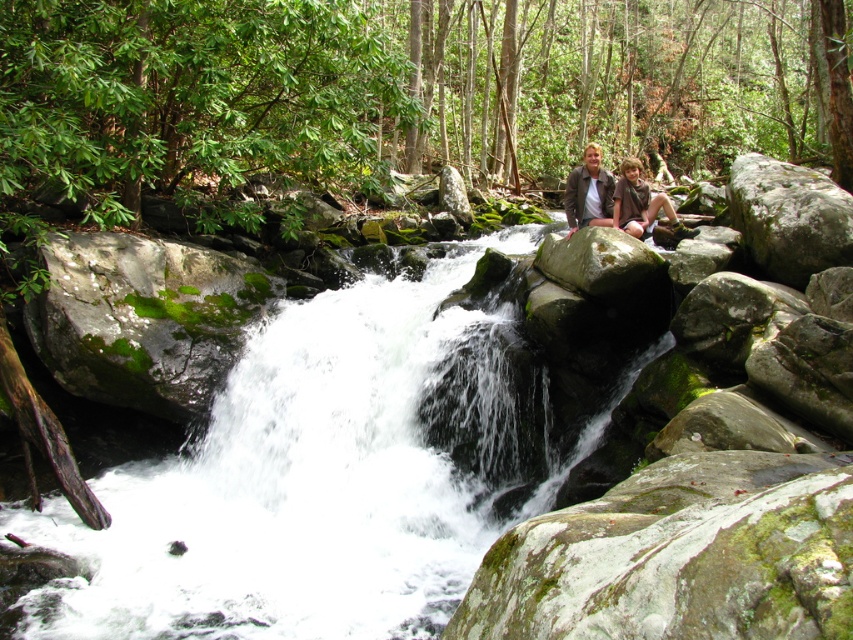
You are standing at the waterfall and want to take a photo. You notice two points in the scene, point A at coordinates point (213, 433) and point B at coordinates point (637, 221). Which point is closer to you?

Point point (213, 433) is closer to the camera than point point (637, 221), so point A is closer to you.

You are an observer standing in front of the waterfall scene. You notice two jackets at the upper center of the image. Which jacket is positioned lower between the brown leather jacket at upper center and the brown suede jacket at upper center?

The brown leather jacket at upper center is positioned lower than the brown suede jacket at upper center.